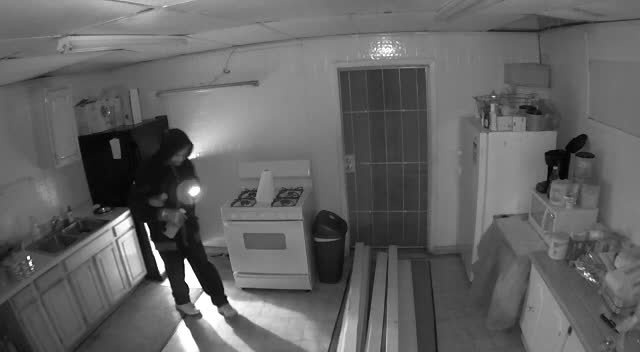
Where is `wooden planks on floor`? The height and width of the screenshot is (352, 640). wooden planks on floor is located at coordinates (372, 340), (388, 275), (393, 346), (342, 345), (358, 269).